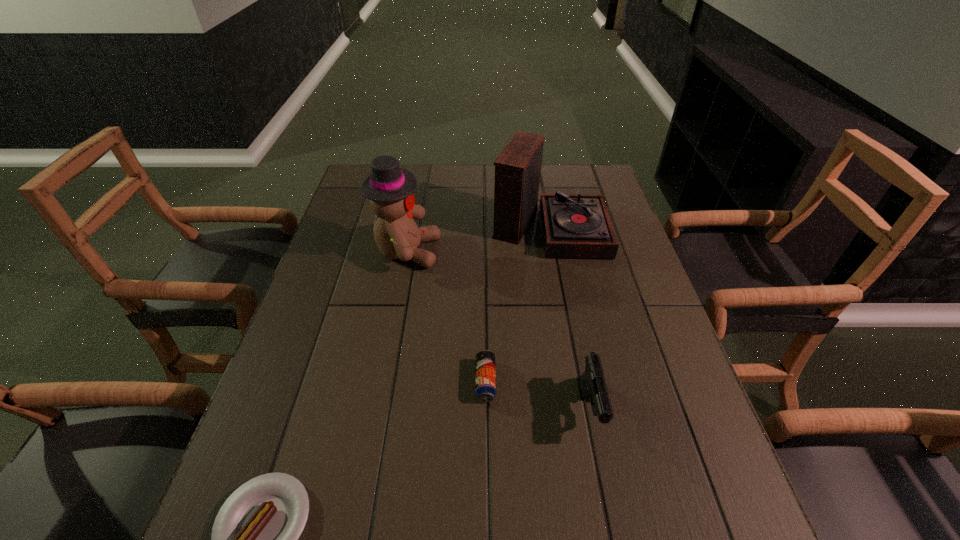
This screenshot has width=960, height=540. I want to click on object situated at the right edge, so click(574, 225).

Find the location of a particular element. The width and height of the screenshot is (960, 540). object that is at the far right corner is located at coordinates pos(574,225).

The width and height of the screenshot is (960, 540). In order to click on free space at the left edge of the desktop in this screenshot , I will do `click(326, 399)`.

You are a GUI agent. You are given a task and a screenshot of the screen. Output one action in this format:
    pyautogui.click(x=<x>, y=<y>)
    Task: Click on the vacant space at the right edge of the desktop
    
    Given the screenshot: What is the action you would take?
    pyautogui.click(x=609, y=342)

Identify the location of vacant space at the near right corner of the desktop. Image resolution: width=960 pixels, height=540 pixels. (711, 537).

You are a GUI agent. You are given a task and a screenshot of the screen. Output one action in this format:
    pyautogui.click(x=<x>, y=<y>)
    Task: Click on the empty space between the phonograph record and the rag_doll
    
    Given the screenshot: What is the action you would take?
    pyautogui.click(x=478, y=238)

Locate an element on the screen. The height and width of the screenshot is (540, 960). vacant area that lies between the third object from right to left and the phonograph record is located at coordinates (517, 303).

Locate an element on the screen. The image size is (960, 540). unoccupied area between the pistol and the third object from left to right is located at coordinates (539, 395).

Find the location of a particular element. free point between the phonograph record and the rag_doll is located at coordinates (478, 238).

Identify the location of vacant region between the beer can and the phonograph record. (517, 303).